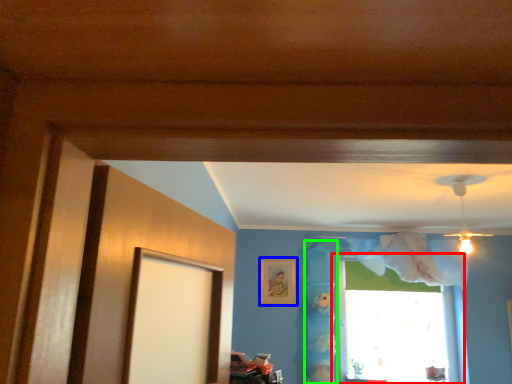
Question: Considering the real-world distances, which object is closest to window (highlighted by a red box)? picture frame (highlighted by a blue box) or curtain (highlighted by a green box).

Choices:
 (A) picture frame
 (B) curtain

Answer: (B)